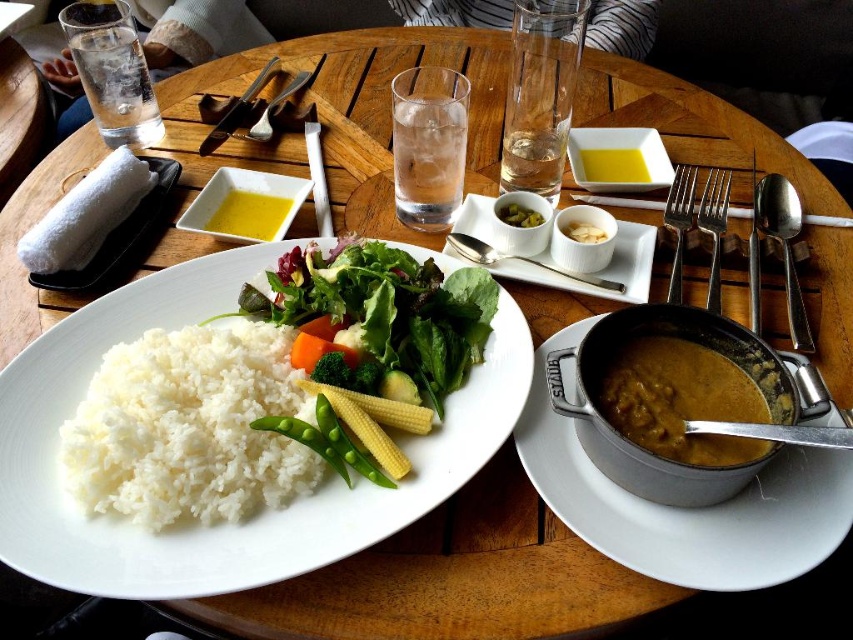
Which of these two, white matte rice at left or green matte peas at center, stands shorter?

green matte peas at center

Which is behind, point (221, 394) or point (328, 435)?

Positioned behind is point (328, 435).

Where is `white matte rice at left`? white matte rice at left is located at coordinates (189, 428).

Does yellow matte square bowl at upper left appear on the left side of yellow matte bowl at upper center?

Correct, you'll find yellow matte square bowl at upper left to the left of yellow matte bowl at upper center.

What do you see at coordinates (245, 205) in the screenshot?
I see `yellow matte square bowl at upper left` at bounding box center [245, 205].

Is point (233, 211) less distant than point (611, 163)?

Yes.

I want to click on yellow matte square bowl at upper left, so (x=245, y=205).

Between point (563, 252) and point (515, 202), which one is positioned in front?

Positioned in front is point (563, 252).

Is point (589, 211) positioned before point (526, 227)?

Yes, point (589, 211) is in front of point (526, 227).

The width and height of the screenshot is (853, 640). What are the coordinates of `white ceramic bowl at center` in the screenshot? It's located at (582, 237).